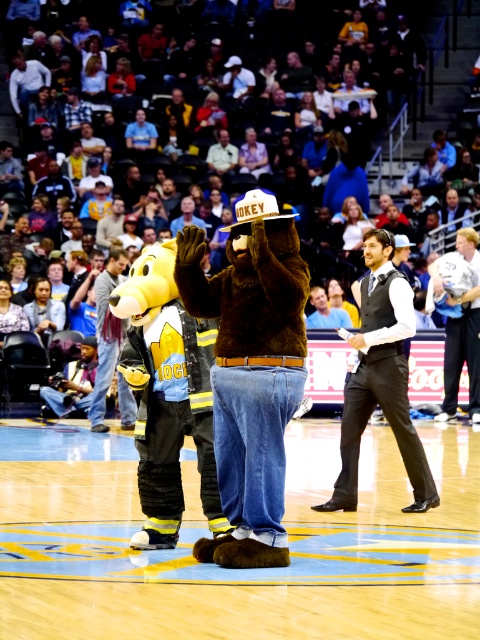
You are a costume designer reviewing the image of the two characters. You need to determine which costume piece is more compact for storage. Which one is smaller between the black satin vest at center and the light blue fabric shirt at center?

The black satin vest at center is smaller than the light blue fabric shirt at center, so it is more compact for storage.

You are a photographer trying to capture the perfect shot of the basketball game. You notice a point marked at coordinates (241, 93) on your camera screen. Based on the scene description, what object is located at that point?

The point at coordinates (241, 93) marks the location of multicolored fabric seats at center.